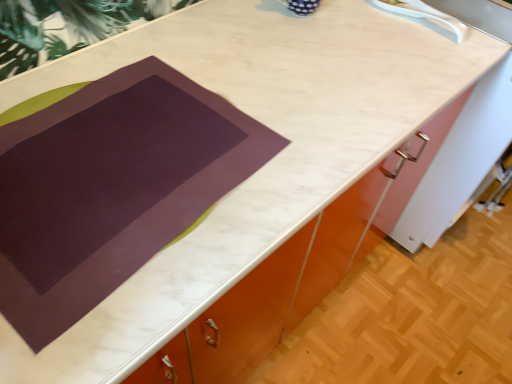
Image resolution: width=512 pixels, height=384 pixels. Identify the location of free space between purple matte placemat at center and white plastic sink at upper right. (324, 77).